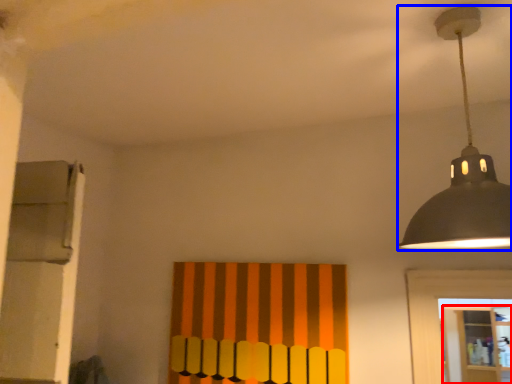
Question: Among these objects, which one is nearest to the camera, shelf (highlighted by a red box) or lamp (highlighted by a blue box)?

Choices:
 (A) shelf
 (B) lamp

Answer: (B)